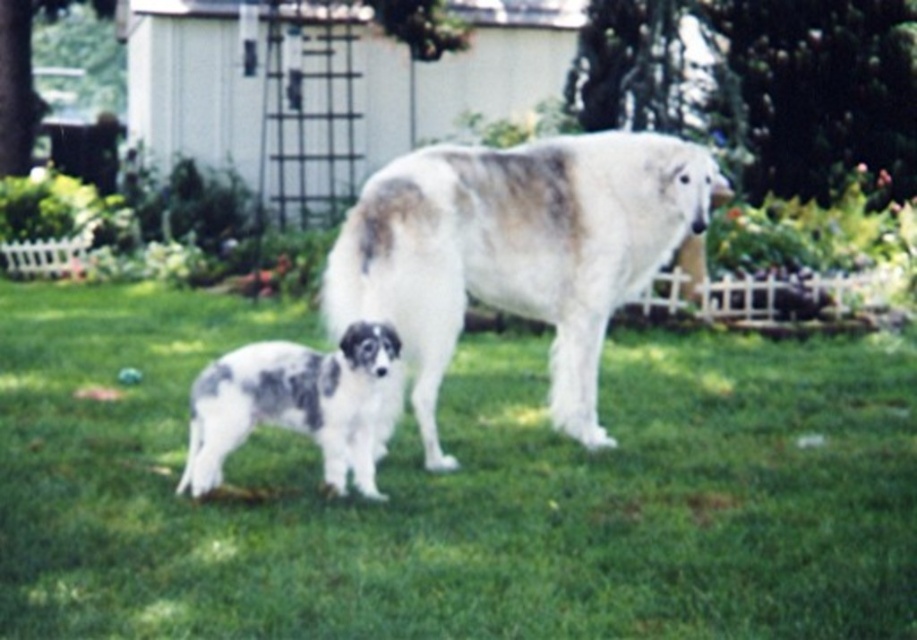
Question: From the image, what is the correct spatial relationship of green grass at center in relation to spotted fur puppy at lower left?

Choices:
 (A) left
 (B) right

Answer: (B)

Question: Can you confirm if green grass at center is positioned above spotted fur puppy at lower left?

Choices:
 (A) yes
 (B) no

Answer: (B)

Question: Which object appears farthest from the camera in this image?

Choices:
 (A) white fur dog at center
 (B) spotted fur puppy at lower left
 (C) green grass at center

Answer: (A)

Question: Can you confirm if white fur dog at center is positioned to the left of spotted fur puppy at lower left?

Choices:
 (A) no
 (B) yes

Answer: (A)

Question: Which object appears closest to the camera in this image?

Choices:
 (A) green grass at center
 (B) spotted fur puppy at lower left

Answer: (A)

Question: Considering the real-world distances, which object is farthest from the spotted fur puppy at lower left?

Choices:
 (A) green grass at center
 (B) white fur dog at center

Answer: (A)